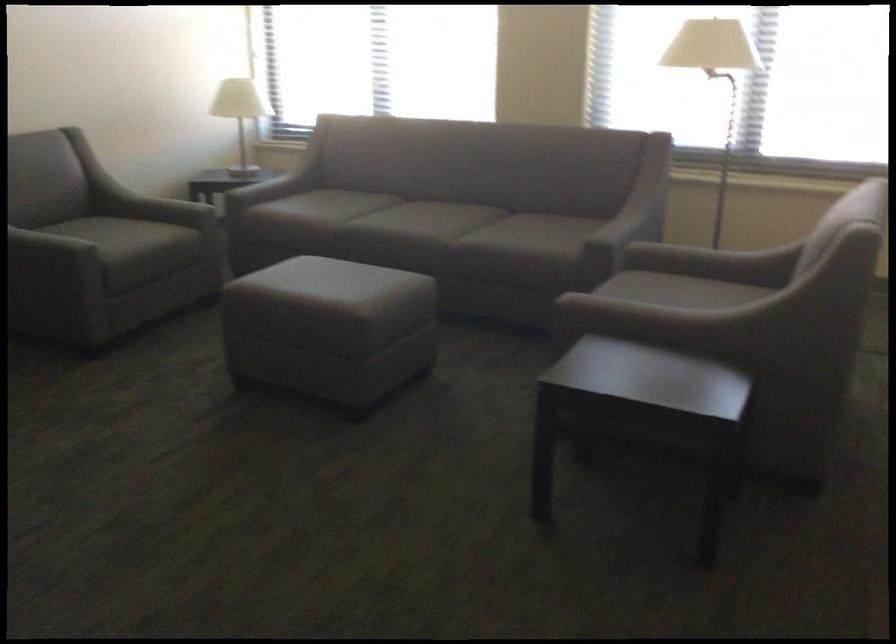
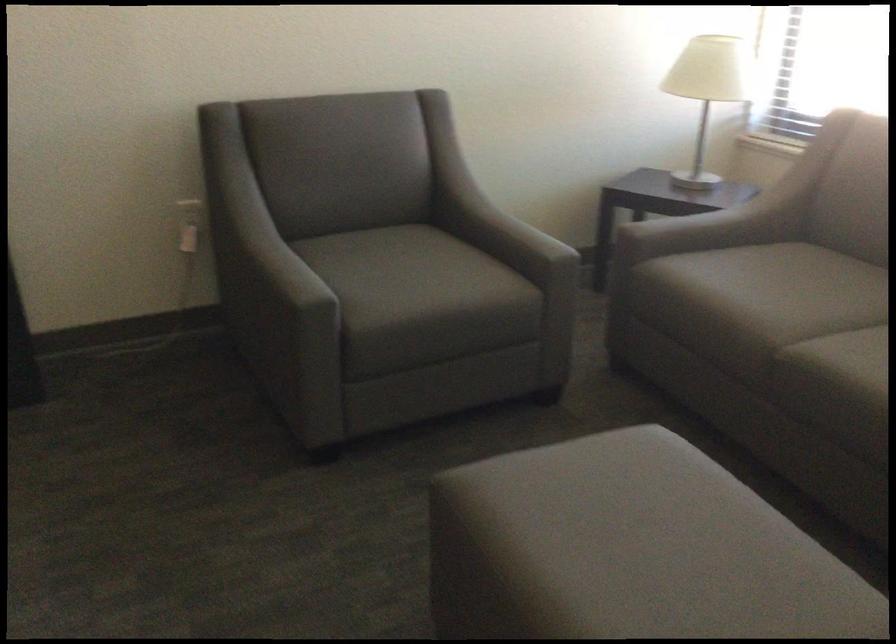
Find the pixel in the second image that matches point (246, 108) in the first image.

(708, 90)